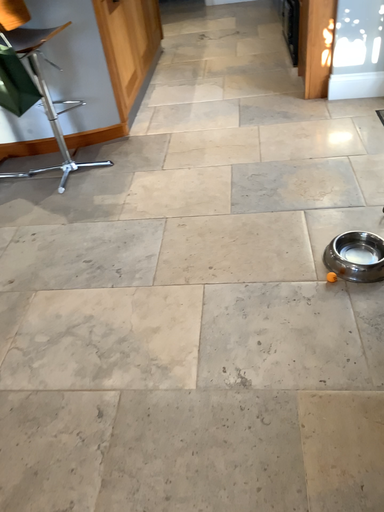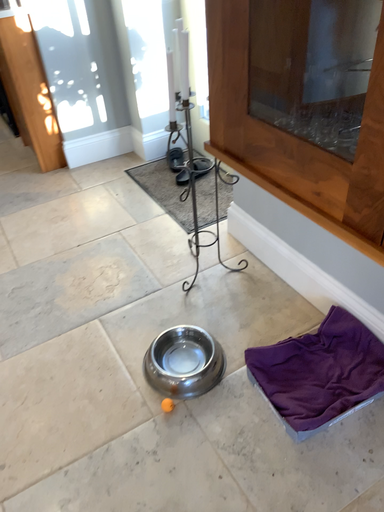
Question: How did the camera likely rotate when shooting the video?

Choices:
 (A) rotated right
 (B) rotated left

Answer: (A)